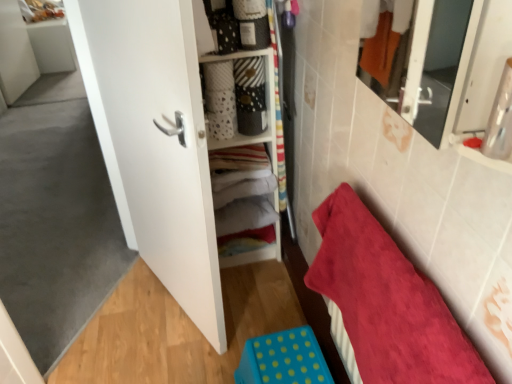
At what (x,y) coordinates should I click in order to perform the action: click on matte white cabinet at center. Please return your answer as a coordinate pair (x, y). Image resolution: width=512 pixels, height=384 pixels. Looking at the image, I should click on [x=246, y=156].

At what (x,y) coordinates should I click in order to perform the action: click on red plush towel at lower right. Please return your answer as a coordinate pair (x, y). The width and height of the screenshot is (512, 384). Looking at the image, I should click on (387, 302).

Where is `white soft fabric at center`? white soft fabric at center is located at coordinates (242, 189).

Image resolution: width=512 pixels, height=384 pixels. What do you see at coordinates (154, 142) in the screenshot? I see `white matte door at center` at bounding box center [154, 142].

Measure the distance between point (154,59) and camera.

The distance of point (154,59) from camera is 3.94 feet.

Image resolution: width=512 pixels, height=384 pixels. I want to click on matte white cabinet at center, so click(x=246, y=156).

The image size is (512, 384). Find the location of `step stool that appears below the matte white cabinet at center (from the image's perspective)`. step stool that appears below the matte white cabinet at center (from the image's perspective) is located at coordinates (283, 359).

How distant is blue polka dot plastic step stool at lower center from matte white cabinet at center?

27.57 inches.

Is blue polka dot plastic step stool at lower center not inside matte white cabinet at center?

blue polka dot plastic step stool at lower center lies outside matte white cabinet at center's area.

Which point is more forward, (248,357) or (264,198)?

→ The point (248,357) is closer.

From their relative heights in the image, would you say white soft fabric at center is taller or shorter than white matte door at center?

In the image, white soft fabric at center appears to be shorter than white matte door at center.

Which is in front, white soft fabric at center or white matte door at center?

white matte door at center is more forward.

Is white soft fabric at center at the right side of white matte door at center?

Yes.

From the image's perspective, which object appears higher, red plush towel at lower right or blue polka dot plastic step stool at lower center?

red plush towel at lower right appears higher in the image.

Is the depth of red plush towel at lower right greater than that of blue polka dot plastic step stool at lower center?

No, it is not.

Is red plush towel at lower right at the left side of blue polka dot plastic step stool at lower center?

Incorrect, red plush towel at lower right is not on the left side of blue polka dot plastic step stool at lower center.

Does red plush towel at lower right turn towards blue polka dot plastic step stool at lower center?

Yes, red plush towel at lower right is facing blue polka dot plastic step stool at lower center.

Is blue polka dot plastic step stool at lower center located outside white matte door at center?

That's correct, blue polka dot plastic step stool at lower center is outside of white matte door at center.

Looking at this image, from a real-world perspective, between blue polka dot plastic step stool at lower center and white matte door at center, who is vertically higher?

white matte door at center, from a real-world perspective.

Consider the image. Can you confirm if blue polka dot plastic step stool at lower center is shorter than white matte door at center?

Indeed, blue polka dot plastic step stool at lower center has a lesser height compared to white matte door at center.

Between white matte door at center and red plush towel at lower right, which one is positioned in front?

red plush towel at lower right is more forward.

Is white matte door at center not near red plush towel at lower right?

They are positioned close to each other.

Would you say white matte door at center is inside or outside red plush towel at lower right?

white matte door at center is not inside red plush towel at lower right, it's outside.

The image size is (512, 384). In order to click on door lying in front of the matte white cabinet at center in this screenshot , I will do `click(154, 142)`.

Is matte white cabinet at center shorter than white matte door at center?

Correct, matte white cabinet at center is not as tall as white matte door at center.

Is matte white cabinet at center inside or outside of white matte door at center?

matte white cabinet at center is spatially situated outside white matte door at center.

Does matte white cabinet at center have a greater width compared to white matte door at center?

Yes, matte white cabinet at center is wider than white matte door at center.

Would you say matte white cabinet at center is part of white matte door at center's contents?

That's incorrect, matte white cabinet at center is not inside white matte door at center.

Between white matte door at center and matte white cabinet at center, which one appears on the left side from the viewer's perspective?

white matte door at center is more to the left.

Considering the relative sizes of white matte door at center and matte white cabinet at center in the image provided, is white matte door at center shorter than matte white cabinet at center?

Incorrect, the height of white matte door at center does not fall short of that of matte white cabinet at center.

From the image's perspective, would you say white matte door at center is shown under matte white cabinet at center?

Yes, from the image's perspective, white matte door at center is beneath matte white cabinet at center.

The height and width of the screenshot is (384, 512). I want to click on step stool that appears on the right of matte white cabinet at center, so click(x=283, y=359).

Where is `door above the white soft fabric at center (from a real-world perspective)`? This screenshot has height=384, width=512. door above the white soft fabric at center (from a real-world perspective) is located at coordinates pyautogui.click(x=154, y=142).

When comparing their distances from red plush towel at lower right, does white matte door at center or matte white cabinet at center seem closer?

white matte door at center is closer to red plush towel at lower right.

From the image, which object appears to be nearer to white soft fabric at center, blue polka dot plastic step stool at lower center or white matte door at center?

Among the two, white matte door at center is located nearer to white soft fabric at center.

Which object lies nearer to the anchor point red plush towel at lower right, white soft fabric at center or blue polka dot plastic step stool at lower center?

Based on the image, blue polka dot plastic step stool at lower center appears to be nearer to red plush towel at lower right.

Considering their positions, is blue polka dot plastic step stool at lower center positioned further to white matte door at center than matte white cabinet at center?

blue polka dot plastic step stool at lower center lies further to white matte door at center than the other object.

Estimate the real-world distances between objects in this image. Which object is closer to matte white cabinet at center, red plush towel at lower right or white soft fabric at center?

white soft fabric at center lies closer to matte white cabinet at center than the other object.

Considering their positions, is blue polka dot plastic step stool at lower center positioned closer to white matte door at center than white soft fabric at center?

white soft fabric at center is positioned closer to the anchor white matte door at center.

Estimate the real-world distances between objects in this image. Which object is closer to blue polka dot plastic step stool at lower center, red plush towel at lower right or matte white cabinet at center?

red plush towel at lower right lies closer to blue polka dot plastic step stool at lower center than the other object.

Considering their positions, is white matte door at center positioned further to white soft fabric at center than blue polka dot plastic step stool at lower center?

blue polka dot plastic step stool at lower center.

In order to click on step stool between white matte door at center and white soft fabric at center in the front-back direction in this screenshot , I will do `click(283, 359)`.

Find the location of a particular element. This screenshot has height=384, width=512. cabinet between white matte door at center and white soft fabric at center from front to back is located at coordinates (246, 156).

In order to click on step stool between red plush towel at lower right and white soft fabric at center in the front-back direction in this screenshot , I will do coord(283,359).

Where is `step stool located between red plush towel at lower right and matte white cabinet at center in the depth direction`? The height and width of the screenshot is (384, 512). step stool located between red plush towel at lower right and matte white cabinet at center in the depth direction is located at coordinates (283, 359).